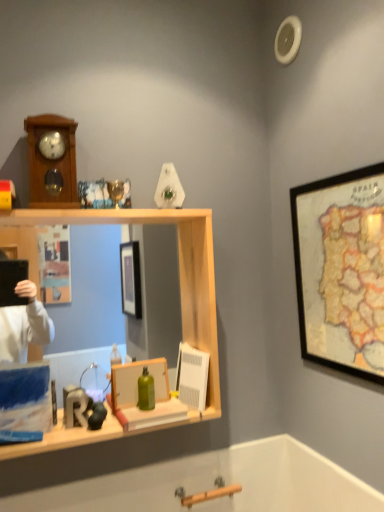
The height and width of the screenshot is (512, 384). Describe the element at coordinates (146, 391) in the screenshot. I see `green matte bottle at center` at that location.

Measure the distance between wooden framed map at upper right, the second picture frame in the left-to-right sequence, and camera.

A distance of 1.00 meters exists between wooden framed map at upper right, the second picture frame in the left-to-right sequence, and camera.

In order to face matte wooden picture frame at center, the 1th picture frame viewed from the left, should I rotate leftwards or rightwards?

You should look left and rotate roughly 6.455 degrees.

This screenshot has width=384, height=512. Identify the location of blue matte box at left. (25, 398).

This screenshot has height=512, width=384. Describe the element at coordinates (179, 269) in the screenshot. I see `wooden shelf at center` at that location.

Find the location of a particular element. The height and width of the screenshot is (512, 384). wooden clock at upper left is located at coordinates (52, 161).

Who is smaller, blue matte box at left or matte wooden picture frame at center, the 1th picture frame viewed from the left?

matte wooden picture frame at center, the 1th picture frame viewed from the left.

Does blue matte box at left turn towards matte wooden picture frame at center, the 1th picture frame viewed from the left?

No, blue matte box at left is not turned towards matte wooden picture frame at center, the 1th picture frame viewed from the left.

Is blue matte box at left positioned far away from matte wooden picture frame at center, which is counted as the second picture frame, starting from the right?

Actually, blue matte box at left and matte wooden picture frame at center, which is counted as the second picture frame, starting from the right, are a little close together.

Between blue matte box at left and matte wooden picture frame at center, placed as the 1th picture frame when sorted from bottom to top, which one has smaller width?

blue matte box at left.

You are a GUI agent. You are given a task and a screenshot of the screen. Output one action in this format:
    pyautogui.click(x=<x>, y=<y>)
    Task: Click on the desk below the wooden clock at upper left (from a real-world perspective)
    The image size is (384, 512).
    Given the screenshot: What is the action you would take?
    pyautogui.click(x=179, y=269)

What's the angular difference between wooden clock at upper left and wooden shelf at center's facing directions?

The facing directions of wooden clock at upper left and wooden shelf at center are 0.0386 degrees apart.

From the image's perspective, which is above, wooden clock at upper left or wooden shelf at center?

wooden clock at upper left.

Considering the positions of points (41, 126) and (201, 211), is point (41, 126) farther from camera compared to point (201, 211)?

No, it is in front of (201, 211).

Which is farther, (x=141, y=385) or (x=25, y=447)?

The point (x=141, y=385) is farther from the camera.

Is green matte bottle at center bigger or smaller than wooden shelf at center?

Answer: green matte bottle at center is smaller than wooden shelf at center.

Considering the sizes of objects green matte bottle at center and wooden shelf at center in the image provided, who is shorter, green matte bottle at center or wooden shelf at center?

green matte bottle at center.

Based on the photo, considering the relative sizes of wooden shelf at center and wooden framed map at upper right, positioned as the second picture frame in bottom-to-top order, in the image provided, is wooden shelf at center thinner than wooden framed map at upper right, positioned as the second picture frame in bottom-to-top order,?

Incorrect, the width of wooden shelf at center is not less than that of wooden framed map at upper right, positioned as the second picture frame in bottom-to-top order.

From the image's perspective, does wooden shelf at center appear higher than wooden framed map at upper right, the second picture frame in the left-to-right sequence?

Incorrect, from the image's perspective, wooden shelf at center is lower than wooden framed map at upper right, the second picture frame in the left-to-right sequence.

Is wooden shelf at center directly adjacent to wooden framed map at upper right, positioned as the second picture frame in bottom-to-top order?

No.

Which object is wider, wooden framed map at upper right, the first picture frame in the top-to-bottom sequence, or blue matte box at left?

wooden framed map at upper right, the first picture frame in the top-to-bottom sequence.

Is wooden framed map at upper right, positioned as the second picture frame in bottom-to-top order, further to the viewer compared to blue matte box at left?

No, it is in front of blue matte box at left.

Is wooden framed map at upper right, the second picture frame in the left-to-right sequence, next to blue matte box at left and touching it?

wooden framed map at upper right, the second picture frame in the left-to-right sequence, is not next to blue matte box at left, and they're not touching.

Is wooden framed map at upper right, the second picture frame in the left-to-right sequence, aimed at blue matte box at left?

Yes.

Which object is positioned more to the left, wooden clock at upper left or blue matte box at left?

blue matte box at left is more to the left.

Is wooden clock at upper left looking in the opposite direction of blue matte box at left?

No, blue matte box at left is not at the back of wooden clock at upper left.

Which object is wider, wooden clock at upper left or blue matte box at left?

Wider between the two is wooden clock at upper left.

Considering the sizes of objects wooden clock at upper left and blue matte box at left in the image provided, who is smaller, wooden clock at upper left or blue matte box at left?

With smaller size is blue matte box at left.

Is wooden shelf at center to the right of green matte bottle at center from the viewer's perspective?

Incorrect, wooden shelf at center is not on the right side of green matte bottle at center.

Is wooden shelf at center wider than green matte bottle at center?

Correct, the width of wooden shelf at center exceeds that of green matte bottle at center.

From the image's perspective, which is above, wooden shelf at center or green matte bottle at center?

wooden shelf at center is shown above in the image.

Between wooden shelf at center and green matte bottle at center, which one is positioned behind?

green matte bottle at center is further from the camera.

The image size is (384, 512). What are the coordinates of `picture frame that appears behind the blue matte box at left` in the screenshot? It's located at (137, 382).

Identify the location of clock to the left of wooden shelf at center. This screenshot has width=384, height=512. (52, 161).

Looking at the image, which one is located further to wooden clock at upper left, green matte bottle at center or wooden shelf at center?

green matte bottle at center lies further to wooden clock at upper left than the other object.

From the image, which object appears to be farther from wooden clock at upper left, wooden framed map at upper right, the first picture frame in the top-to-bottom sequence, or blue matte box at left?

wooden framed map at upper right, the first picture frame in the top-to-bottom sequence, lies further to wooden clock at upper left than the other object.

Considering their positions, is wooden shelf at center positioned closer to wooden clock at upper left than blue matte box at left?

wooden shelf at center is closer to wooden clock at upper left.

From the image, which object appears to be nearer to wooden framed map at upper right, placed as the 1th picture frame when sorted from right to left, blue matte box at left or matte wooden picture frame at center, the 2th picture frame in the top-to-bottom sequence?

The object closer to wooden framed map at upper right, placed as the 1th picture frame when sorted from right to left, is matte wooden picture frame at center, the 2th picture frame in the top-to-bottom sequence.

Estimate the real-world distances between objects in this image. Which object is closer to blue matte box at left, matte wooden picture frame at center, the 2th picture frame in the top-to-bottom sequence, or wooden framed map at upper right, the second picture frame in the left-to-right sequence?

Based on the image, matte wooden picture frame at center, the 2th picture frame in the top-to-bottom sequence, appears to be nearer to blue matte box at left.

Considering their positions, is wooden clock at upper left positioned closer to matte wooden picture frame at center, the 2th picture frame in the top-to-bottom sequence, than wooden shelf at center?

wooden shelf at center.

From the image, which object appears to be farther from matte wooden picture frame at center, the 1th picture frame viewed from the left, wooden framed map at upper right, positioned as the second picture frame in bottom-to-top order, or wooden clock at upper left?

The object further to matte wooden picture frame at center, the 1th picture frame viewed from the left, is wooden framed map at upper right, positioned as the second picture frame in bottom-to-top order.

Considering their positions, is blue matte box at left positioned closer to green matte bottle at center than wooden shelf at center?

blue matte box at left is positioned closer to the anchor green matte bottle at center.

The width and height of the screenshot is (384, 512). What are the coordinates of `clock between blue matte box at left and wooden framed map at upper right, the first picture frame in the top-to-bottom sequence, from left to right` in the screenshot? It's located at (52, 161).

Find the location of a particular element. The width and height of the screenshot is (384, 512). bottle between blue matte box at left and wooden framed map at upper right, the second picture frame in the left-to-right sequence, from left to right is located at coordinates (146, 391).

Locate an element on the screen. bottle situated between wooden shelf at center and wooden framed map at upper right, positioned as the second picture frame in bottom-to-top order, from left to right is located at coordinates (146, 391).

Where is `desk between blue matte box at left and wooden framed map at upper right, positioned as the second picture frame in bottom-to-top order, from left to right`? The height and width of the screenshot is (512, 384). desk between blue matte box at left and wooden framed map at upper right, positioned as the second picture frame in bottom-to-top order, from left to right is located at coordinates (179, 269).